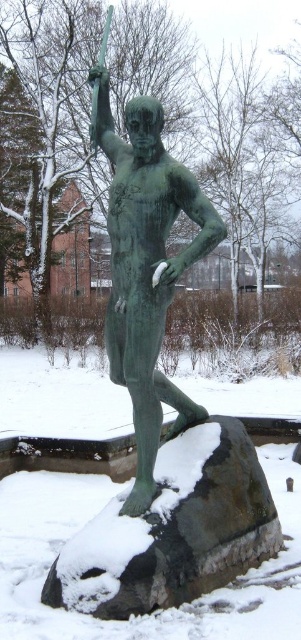
Question: Which object appears closest to the camera in this image?

Choices:
 (A) green patina bronze statue at center
 (B) snow-covered rock at center

Answer: (B)

Question: Can you confirm if snow-covered rock at center is bigger than green patina bronze statue at center?

Choices:
 (A) yes
 (B) no

Answer: (B)

Question: Among these objects, which one is farthest from the camera?

Choices:
 (A) green patina bronze statue at center
 (B) snow-covered rock at center

Answer: (A)

Question: Considering the relative positions of snow-covered rock at center and green patina bronze statue at center in the image provided, where is snow-covered rock at center located with respect to green patina bronze statue at center?

Choices:
 (A) above
 (B) below

Answer: (B)

Question: Is snow-covered rock at center below green patina bronze statue at center?

Choices:
 (A) yes
 (B) no

Answer: (A)